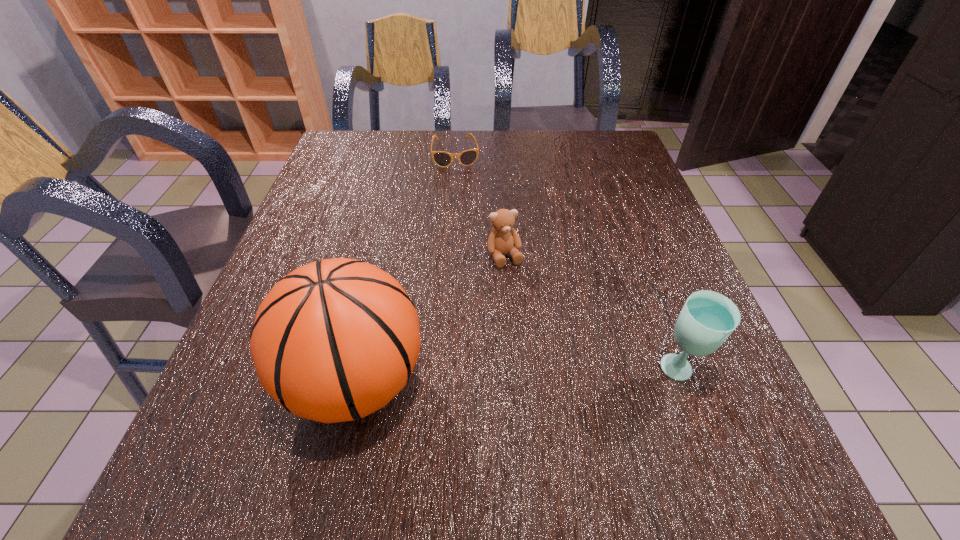
Locate an element on the screen. This screenshot has height=540, width=960. empty location between the shortest object and the third shortest object is located at coordinates (567, 262).

Find the location of a particular element. vacant space that's between the rightmost object and the tallest object is located at coordinates (517, 377).

The width and height of the screenshot is (960, 540). Identify the location of free space between the third tallest object and the farthest object. (480, 205).

Where is `empty location between the second farthest object and the shortest object`? empty location between the second farthest object and the shortest object is located at coordinates coord(480,205).

This screenshot has width=960, height=540. Find the location of `vacant region between the third tallest object and the basketball`. vacant region between the third tallest object and the basketball is located at coordinates (430, 319).

Where is `vacant space that is in between the shortest object and the tallest object`? vacant space that is in between the shortest object and the tallest object is located at coordinates (406, 268).

Identify which object is located as the nearest to the basketball. Please provide its 2D coordinates. Your answer should be formatted as a tuple, i.e. [(x, y)], where the tuple contains the x and y coordinates of a point satisfying the conditions above.

[(503, 238)]

Locate which object is the closest to the shortest object. Please provide its 2D coordinates. Your answer should be formatted as a tuple, i.e. [(x, y)], where the tuple contains the x and y coordinates of a point satisfying the conditions above.

[(503, 238)]

What are the coordinates of `free region that satisfies the following two spatial constraints: 1. on the front side of the shortest object; 2. on the left side of the second farthest object` in the screenshot? It's located at (448, 256).

This screenshot has height=540, width=960. I want to click on free space that satisfies the following two spatial constraints: 1. on the front side of the third tallest object; 2. on the left side of the rightmost object, so click(511, 372).